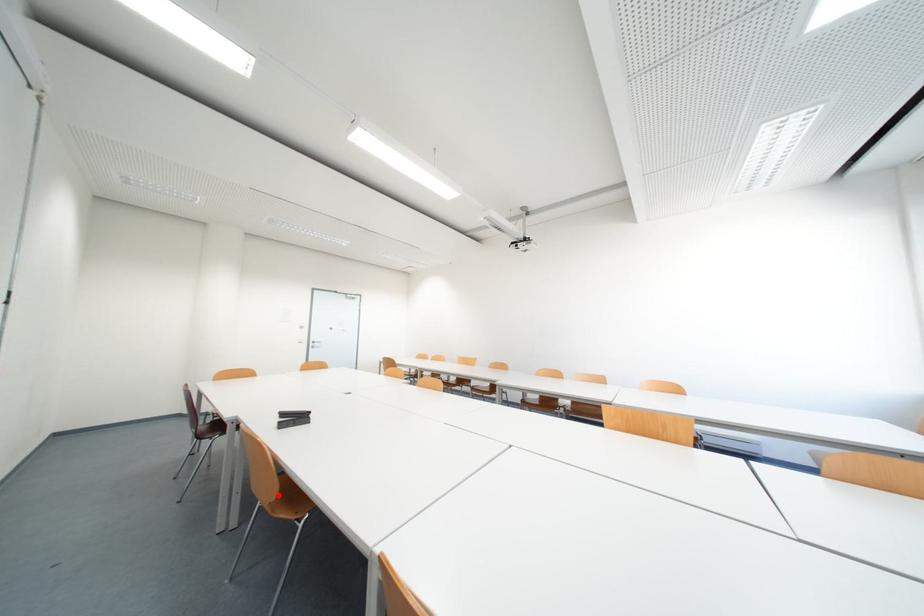
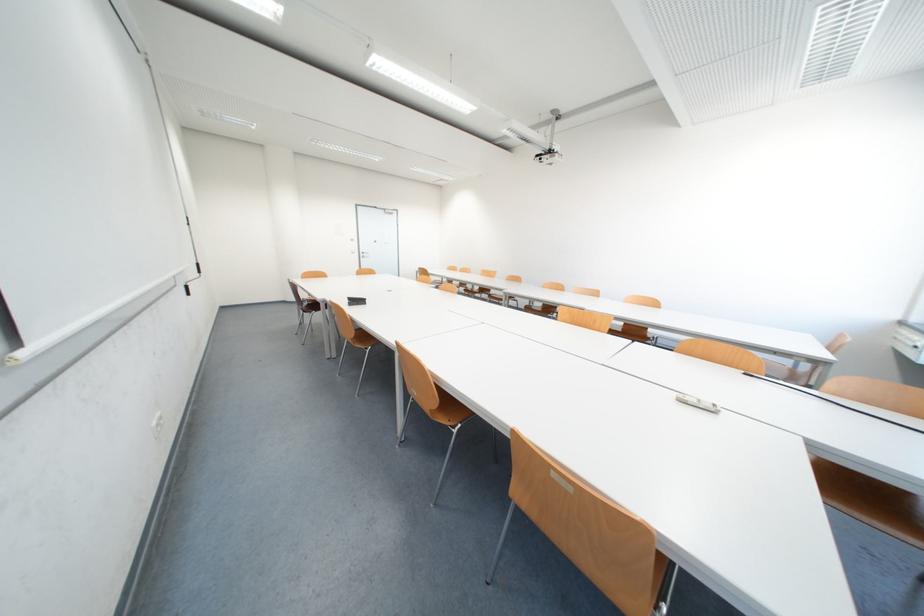
Locate, in the second image, the point that corresponds to the highlighted location in the first image.

(359, 336)